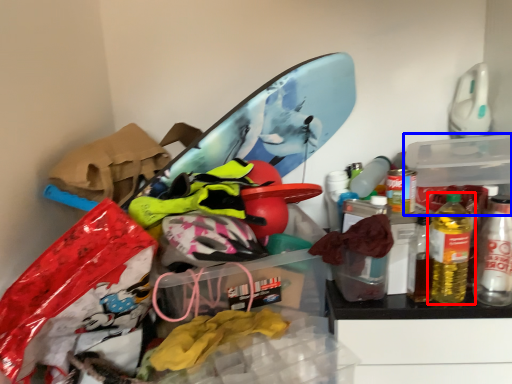
Question: Which object appears closest to the camera in this image, bottle (highlighted by a red box) or storage box (highlighted by a blue box)?

Choices:
 (A) bottle
 (B) storage box

Answer: (A)